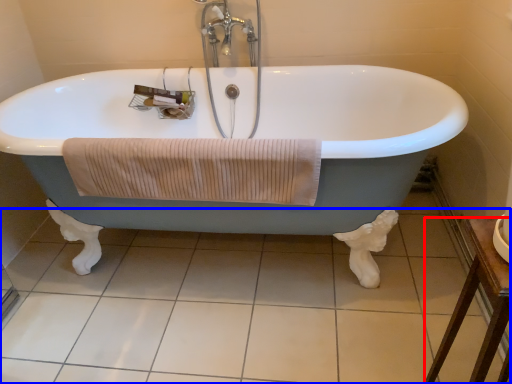
Question: Which object is further to the camera taking this photo, furniture (highlighted by a red box) or tile (highlighted by a blue box)?

Choices:
 (A) furniture
 (B) tile

Answer: (B)